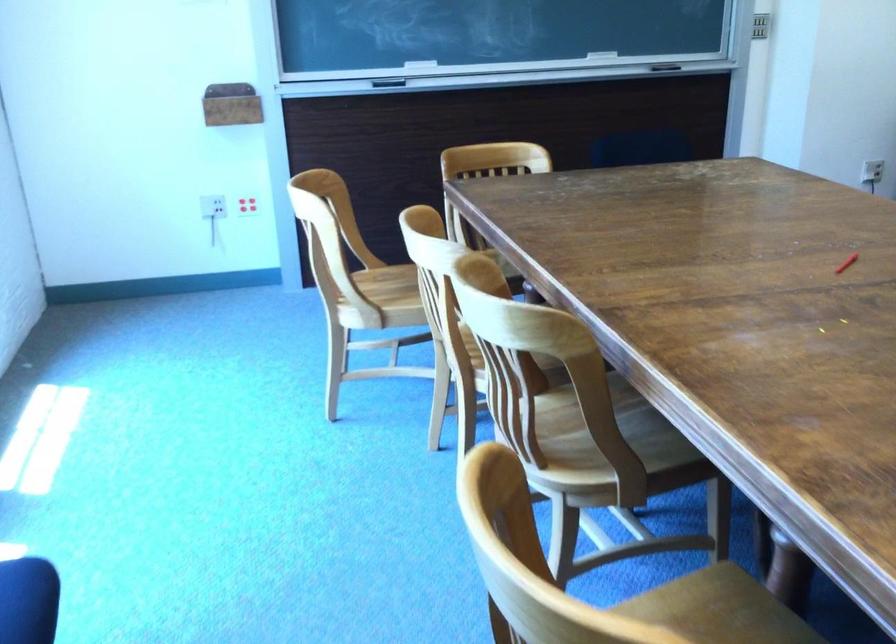
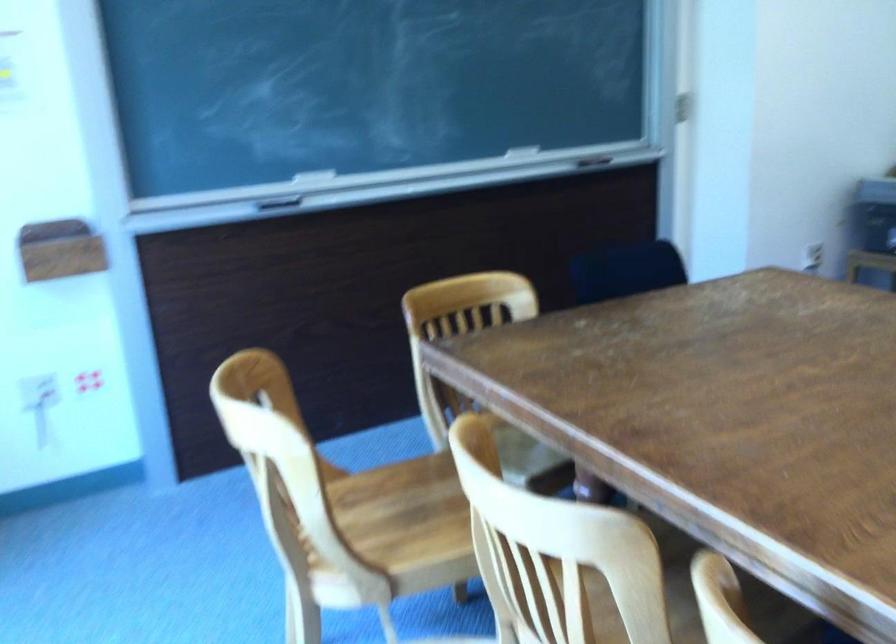
What movement of the cameraman would produce the second image?

The movement direction of the cameraman is left, forward.